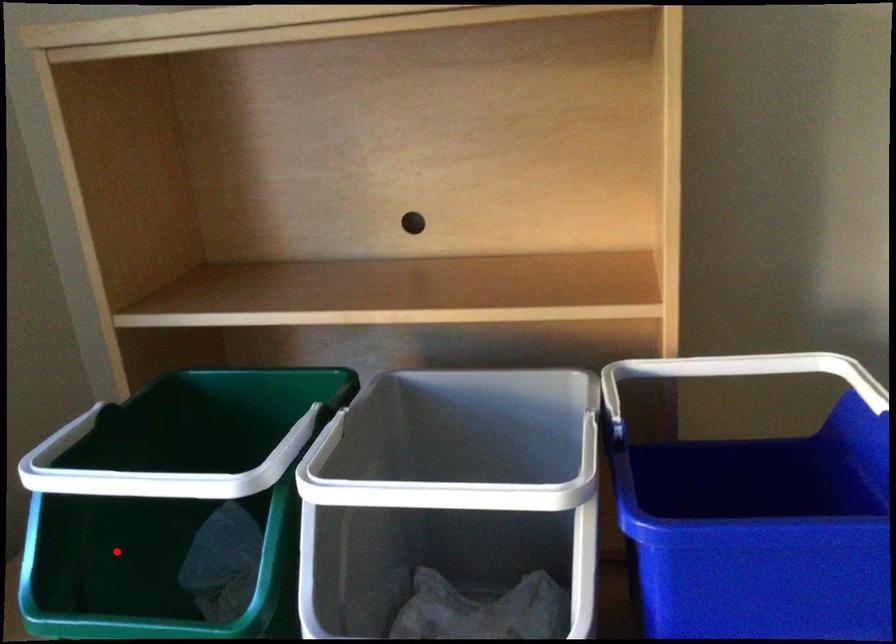
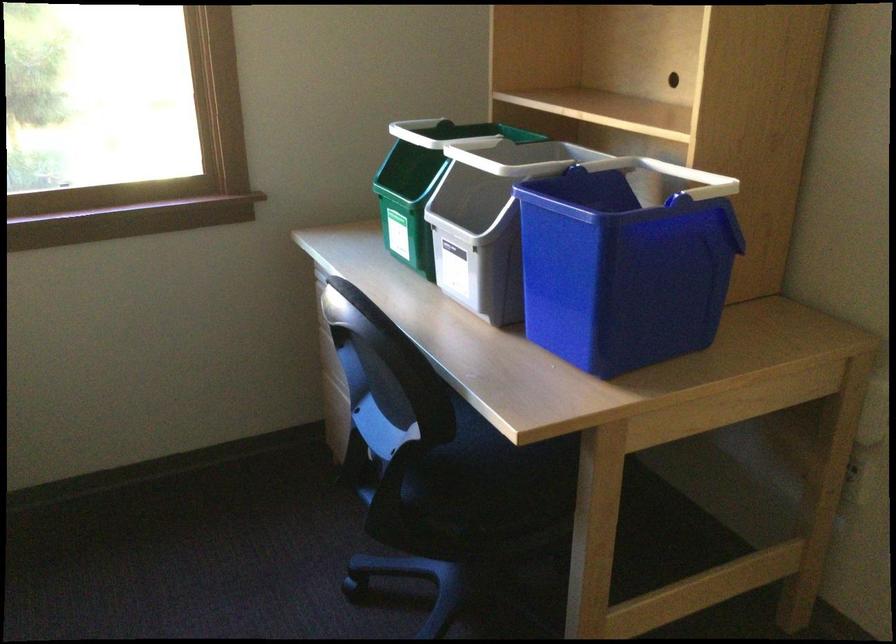
Question: A red point is marked in image1. In image2, is the corresponding 3D point closer to the camera or farther? Reply with the corresponding letter.

Choices:
 (A) The corresponding 3D point is closer.
 (B) The corresponding 3D point is farther.

Answer: (B)